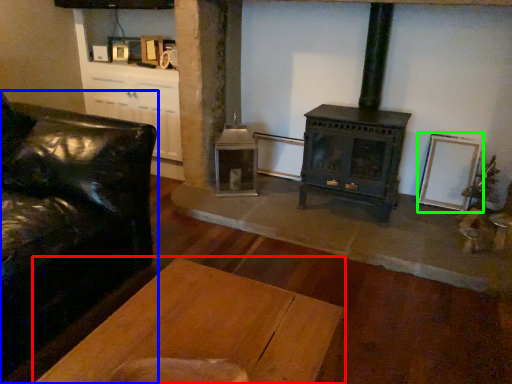
Question: Estimate the real-world distances between objects in this image. Which object is farther from table (highlighted by a red box), studio couch (highlighted by a blue box) or picture frame (highlighted by a green box)?

Choices:
 (A) studio couch
 (B) picture frame

Answer: (B)